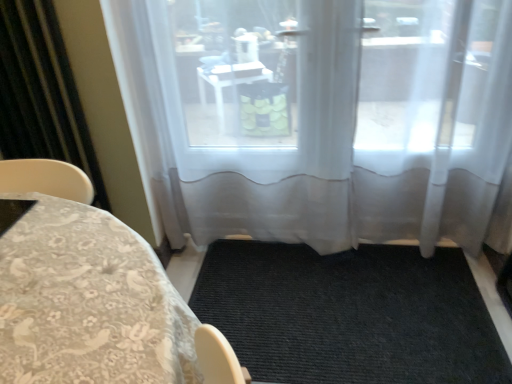
Question: Is black sheer curtain at left taller than patterned fabric tablecloth at lower left?

Choices:
 (A) yes
 (B) no

Answer: (A)

Question: Does black sheer curtain at left have a lesser width compared to patterned fabric tablecloth at lower left?

Choices:
 (A) yes
 (B) no

Answer: (A)

Question: From the image's perspective, is black sheer curtain at left located above patterned fabric tablecloth at lower left?

Choices:
 (A) no
 (B) yes

Answer: (B)

Question: Is black sheer curtain at left turned away from patterned fabric tablecloth at lower left?

Choices:
 (A) no
 (B) yes

Answer: (A)

Question: Does black sheer curtain at left lie in front of patterned fabric tablecloth at lower left?

Choices:
 (A) no
 (B) yes

Answer: (A)

Question: Does black sheer curtain at left have a greater width compared to patterned fabric tablecloth at lower left?

Choices:
 (A) yes
 (B) no

Answer: (B)

Question: From a real-world perspective, is black textured mat at center on top of transparent fabric at center?

Choices:
 (A) yes
 (B) no

Answer: (B)

Question: Does black textured mat at center lie behind transparent fabric at center?

Choices:
 (A) yes
 (B) no

Answer: (A)

Question: Considering the relative positions of black textured mat at center and transparent fabric at center in the image provided, is black textured mat at center to the right of transparent fabric at center from the viewer's perspective?

Choices:
 (A) yes
 (B) no

Answer: (A)

Question: Is black textured mat at center taller than transparent fabric at center?

Choices:
 (A) yes
 (B) no

Answer: (B)

Question: Is black textured mat at center to the left of transparent fabric at center from the viewer's perspective?

Choices:
 (A) no
 (B) yes

Answer: (A)

Question: From a real-world perspective, is black textured mat at center under transparent fabric at center?

Choices:
 (A) no
 (B) yes

Answer: (B)

Question: Is patterned fabric tablecloth at lower left taller than transparent fabric at center?

Choices:
 (A) no
 (B) yes

Answer: (A)